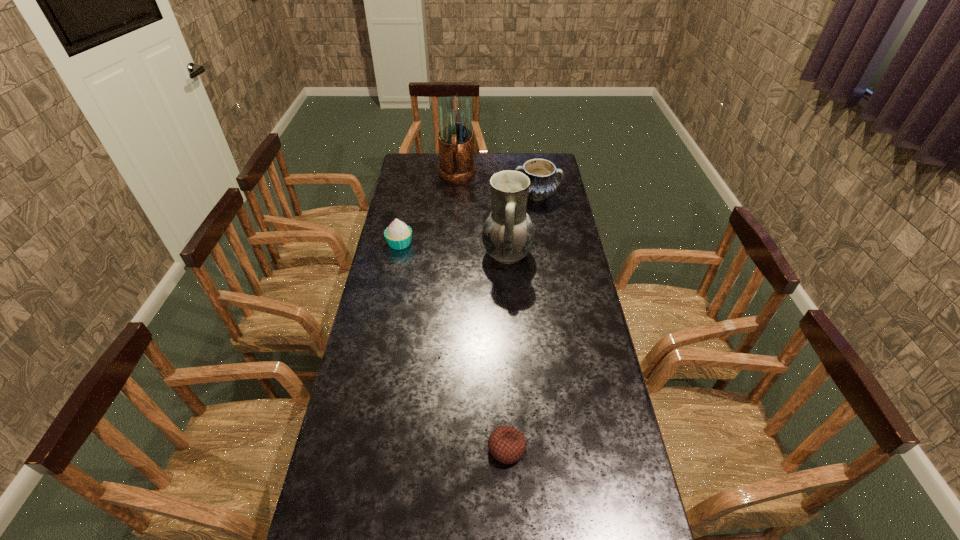
Locate an element on the screen. vacant space located on the front-facing side of the right pitcher is located at coordinates (387, 254).

Locate an element on the screen. This screenshot has width=960, height=540. free point located on the front-facing side of the right pitcher is located at coordinates (459, 254).

Where is `free location located on the front of the pottery`? free location located on the front of the pottery is located at coordinates (548, 264).

This screenshot has height=540, width=960. Identify the location of free region located on the front of the fourth tallest object. (393, 279).

This screenshot has width=960, height=540. Identify the location of free region located on the front of the nearest object. (509, 496).

The width and height of the screenshot is (960, 540). Find the location of `object located in the far edge section of the desktop`. object located in the far edge section of the desktop is located at coordinates (455, 137).

Where is `object that is at the left edge`? Image resolution: width=960 pixels, height=540 pixels. object that is at the left edge is located at coordinates (398, 235).

Find the location of a particular element. The image size is (960, 540). object present at the right edge is located at coordinates (543, 183).

At what (x,y) coordinates should I click in order to perform the action: click on vacant space at the far edge. Please return your answer as a coordinate pair (x, y). Looking at the image, I should click on (477, 177).

In the image, there is a desktop. Identify the location of vacant space at the left edge. Image resolution: width=960 pixels, height=540 pixels. (374, 502).